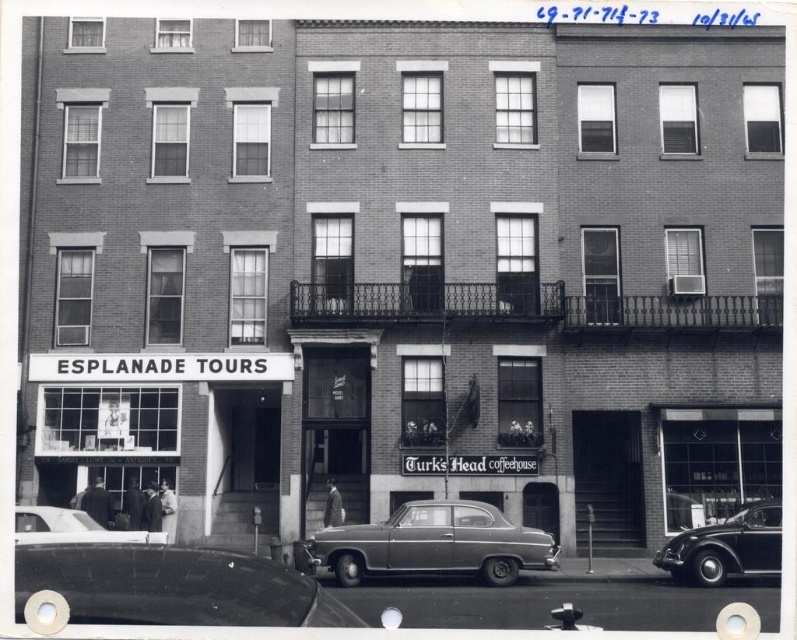
Question: Which point is farther to the camera?

Choices:
 (A) shiny black car at lower right
 (B) white matte signboard at lower left

Answer: (B)

Question: Does metallic gray sedan at center appear on the left side of shiny black car at lower right?

Choices:
 (A) yes
 (B) no

Answer: (A)

Question: Can you confirm if metallic gray sedan at center is positioned to the left of shiny black car at lower right?

Choices:
 (A) yes
 (B) no

Answer: (A)

Question: Among these points, which one is farthest from the camera?

Choices:
 (A) (165, 356)
 (B) (55, 531)
 (C) (724, 518)
 (D) (438, 528)

Answer: (A)

Question: Among these points, which one is nearest to the camera?

Choices:
 (A) (110, 445)
 (B) (309, 540)

Answer: (B)

Question: Is shiny black sedan at lower left to the right of shiny black car at lower right from the viewer's perspective?

Choices:
 (A) yes
 (B) no

Answer: (B)